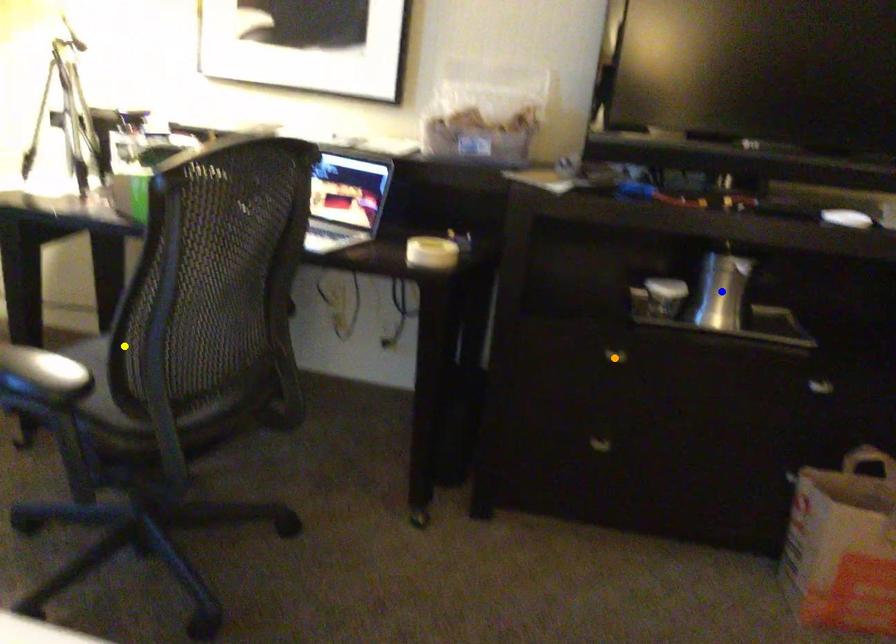
Order these from nearest to farthest:
orange point
yellow point
blue point

yellow point → orange point → blue point